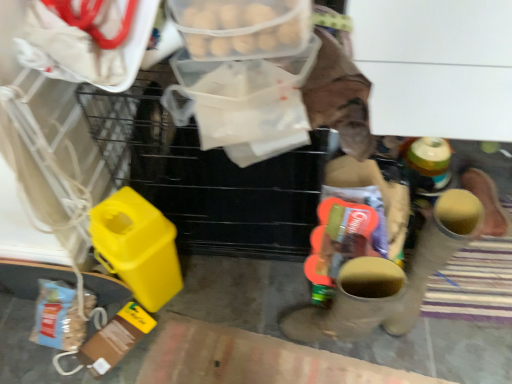
Question: In terms of width, does matte brown boot at center, positioned as the first footwear in left-to-right order, look wider or thinner when compared to translucent plastic container at upper center?

Choices:
 (A) wide
 (B) thin

Answer: (A)

Question: Based on their positions, is matte brown boot at center, which appears as the second footwear when viewed from the right, located to the left or right of translucent plastic container at upper center?

Choices:
 (A) left
 (B) right

Answer: (B)

Question: Which object is positioned closest to the rubber yellow boot at right, the second footwear in the left-to-right sequence?

Choices:
 (A) translucent plastic container at upper center
 (B) matte brown boot at center, which appears as the second footwear when viewed from the right

Answer: (B)

Question: Which of these objects is positioned closest to the rubber yellow boot at right, the second footwear in the left-to-right sequence?

Choices:
 (A) translucent plastic container at upper center
 (B) matte brown boot at center, positioned as the first footwear in left-to-right order

Answer: (B)